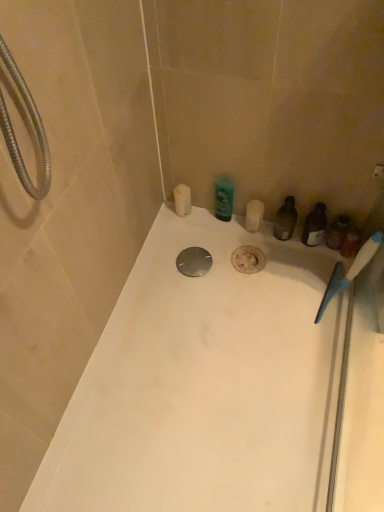
Question: Is white matte candle at upper left, placed as the 3th toiletry when sorted from right to left, not close to green glossy bottle at center, the second toiletry positioned from the right?

Choices:
 (A) yes
 (B) no

Answer: (B)

Question: Is green glossy bottle at center, acting as the second toiletry starting from the left, a part of white matte candle at upper left, the first toiletry from the left?

Choices:
 (A) no
 (B) yes

Answer: (A)

Question: Considering the relative positions of white matte candle at upper left, placed as the 3th toiletry when sorted from right to left, and green glossy bottle at center, the second toiletry positioned from the right, in the image provided, is white matte candle at upper left, placed as the 3th toiletry when sorted from right to left, to the left of green glossy bottle at center, the second toiletry positioned from the right, from the viewer's perspective?

Choices:
 (A) yes
 (B) no

Answer: (A)

Question: From the image's perspective, is white matte candle at upper left, placed as the 3th toiletry when sorted from right to left, above green glossy bottle at center, acting as the second toiletry starting from the left?

Choices:
 (A) no
 (B) yes

Answer: (B)

Question: Considering the relative sizes of white matte candle at upper left, placed as the 3th toiletry when sorted from right to left, and green glossy bottle at center, the second toiletry positioned from the right, in the image provided, is white matte candle at upper left, placed as the 3th toiletry when sorted from right to left, shorter than green glossy bottle at center, the second toiletry positioned from the right,?

Choices:
 (A) no
 (B) yes

Answer: (B)

Question: Considering the positions of point (182, 200) and point (311, 279), is point (182, 200) closer or farther from the camera than point (311, 279)?

Choices:
 (A) closer
 (B) farther

Answer: (B)

Question: Visually, is white matte candle at upper left, placed as the 3th toiletry when sorted from right to left, positioned to the left or to the right of white glossy bathtub at center?

Choices:
 (A) left
 (B) right

Answer: (A)

Question: Relative to white glossy bathtub at center, is white matte candle at upper left, placed as the 3th toiletry when sorted from right to left, in front or behind?

Choices:
 (A) behind
 (B) front

Answer: (A)

Question: Looking at the image, does white matte candle at upper left, placed as the 3th toiletry when sorted from right to left, seem bigger or smaller compared to white glossy bathtub at center?

Choices:
 (A) big
 (B) small

Answer: (B)

Question: Considering the positions of blue plastic toothbrush at right and white matte candle at upper left, the first toiletry from the left, in the image, is blue plastic toothbrush at right bigger or smaller than white matte candle at upper left, the first toiletry from the left,?

Choices:
 (A) small
 (B) big

Answer: (B)

Question: Would you say blue plastic toothbrush at right is inside or outside white matte candle at upper left, placed as the 3th toiletry when sorted from right to left?

Choices:
 (A) inside
 (B) outside

Answer: (B)

Question: Considering the positions of point (336, 287) and point (188, 194), is point (336, 287) closer or farther from the camera than point (188, 194)?

Choices:
 (A) farther
 (B) closer

Answer: (B)

Question: From their relative heights in the image, would you say blue plastic toothbrush at right is taller or shorter than white matte candle at upper left, placed as the 3th toiletry when sorted from right to left?

Choices:
 (A) short
 (B) tall

Answer: (B)

Question: From their relative heights in the image, would you say white glossy bathtub at center is taller or shorter than translucent plastic container at right, which is the 1th toiletry from right to left?

Choices:
 (A) short
 (B) tall

Answer: (A)

Question: Considering the positions of white glossy bathtub at center and translucent plastic container at right, the 3th toiletry positioned from the left, in the image, is white glossy bathtub at center wider or thinner than translucent plastic container at right, the 3th toiletry positioned from the left,?

Choices:
 (A) thin
 (B) wide

Answer: (B)